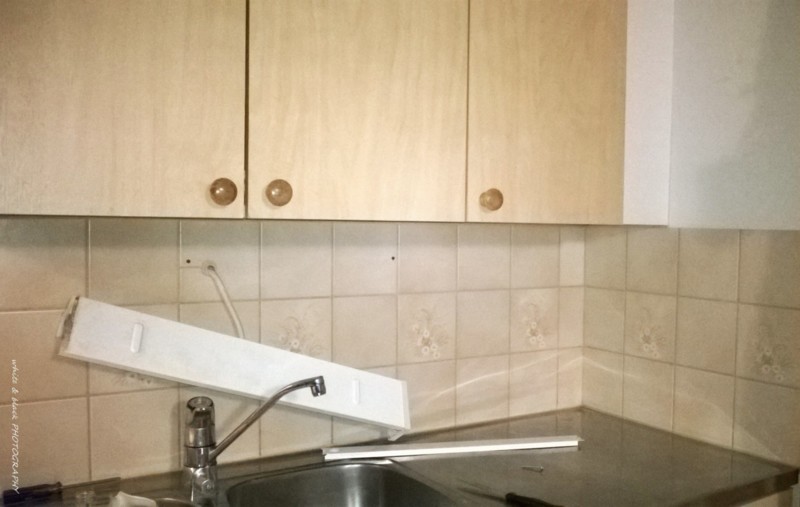
This screenshot has width=800, height=507. Find the location of `faucet handle`. faucet handle is located at coordinates (201, 406).